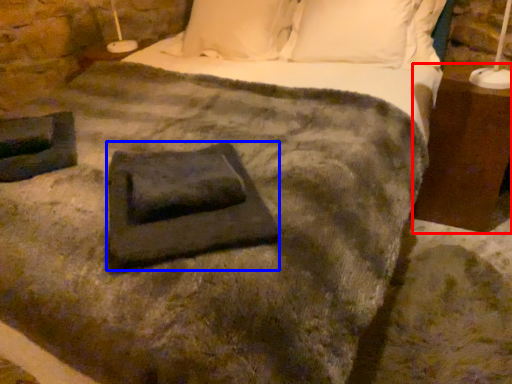
Question: Which object is further to the camera taking this photo, nightstand (highlighted by a red box) or slate (highlighted by a blue box)?

Choices:
 (A) nightstand
 (B) slate

Answer: (A)